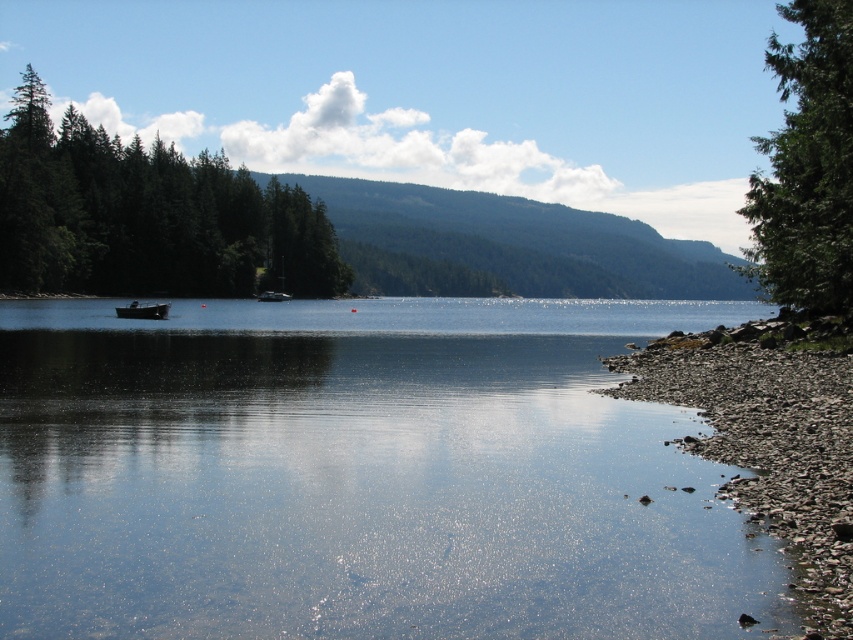
You are standing on the lakeshore and want to take a photo of the green matte trees at left and the clear water at center. Which object should you focus on first if you want to capture both in a single frame without moving the camera?

The green matte trees at left are to the left of the clear water at center, so you should focus on the green matte trees at left first to ensure both are in frame.

You are standing on the lakeside and want to compare the heights of the green textured tree at right and the metallic gray boat at left. Which one is taller?

The green textured tree at right is taller than the metallic gray boat at left.